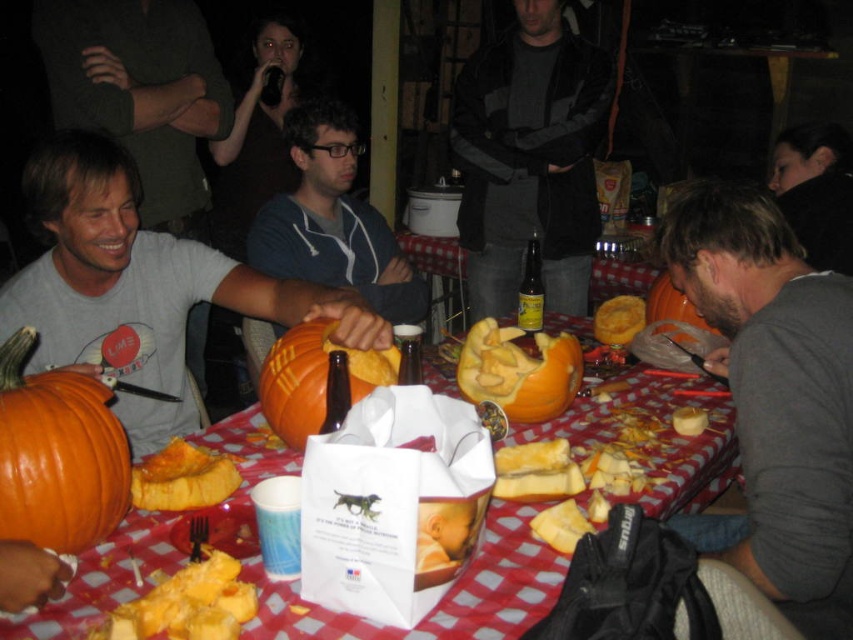
Who is taller, gray cotton shirt at center or matte orange pumpkin at left?

With more height is gray cotton shirt at center.

Can you confirm if gray cotton shirt at center is positioned to the left of matte orange pumpkin at left?

No, gray cotton shirt at center is not to the left of matte orange pumpkin at left.

Is point (822, 536) positioned after point (88, 179)?

No.

Where is `gray cotton shirt at center`? The height and width of the screenshot is (640, 853). gray cotton shirt at center is located at coordinates (775, 397).

Who is shorter, orange matte pumpkin at center or brown glass bottle at center?

With less height is orange matte pumpkin at center.

Does orange matte pumpkin at center have a smaller size compared to brown glass bottle at center?

No, orange matte pumpkin at center is not smaller than brown glass bottle at center.

Who is more distant from viewer, [306,360] or [543,305]?

The point [543,305] is behind.

The width and height of the screenshot is (853, 640). Find the location of `orange matte pumpkin at center`. orange matte pumpkin at center is located at coordinates (314, 378).

Who is positioned more to the right, dark blue zip-up hoodie at center or yellow soft bread at lower left?

From the viewer's perspective, yellow soft bread at lower left appears more on the right side.

Who is taller, dark blue zip-up hoodie at center or yellow soft bread at lower left?

Standing taller between the two is dark blue zip-up hoodie at center.

Which is behind, point (407, 269) or point (149, 602)?

Positioned behind is point (407, 269).

This screenshot has width=853, height=640. Identify the location of dark blue zip-up hoodie at center. (332, 220).